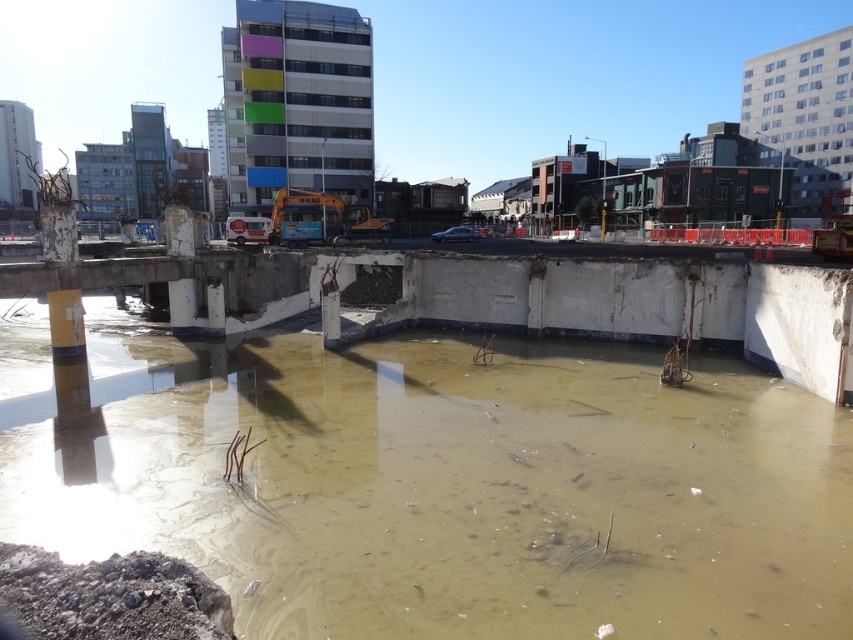
You are a construction worker carrying a tool box that is 1.5 meters wide. You need to cross from the muddy concrete water at center to the concrete bridge at center. Is there enough space between them for you to safely pass through?

The distance between the muddy concrete water at center and the concrete bridge at center is 4.44 meters, which is more than enough space for a tool box that is 1.5 meters wide to pass safely.

You are a construction worker who needs to transport materials across the construction site. You see the muddy concrete water at center and the concrete bridge at center. Which path is wider for your vehicle?

The muddy concrete water at center is wider than the concrete bridge at center, so the muddy concrete water at center would be the wider path for your vehicle.